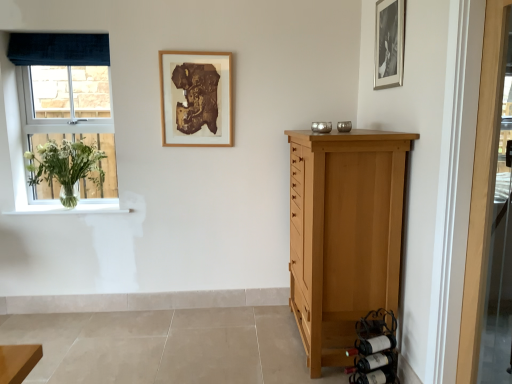
Question: Which direction should I rotate to face wooden picture frame at upper center, the 2th picture frame viewed from the front, — up or down?

Choices:
 (A) down
 (B) up

Answer: (B)

Question: From a real-world perspective, is light brown wood chest of drawers at right on dark brown glass wine bottle at lower right, which appears as the 3th wine bottle when viewed from the top?

Choices:
 (A) yes
 (B) no

Answer: (A)

Question: Considering the relative sizes of light brown wood chest of drawers at right and dark brown glass wine bottle at lower right, marked as the 1th wine bottle in a bottom-to-top arrangement, in the image provided, is light brown wood chest of drawers at right thinner than dark brown glass wine bottle at lower right, marked as the 1th wine bottle in a bottom-to-top arrangement,?

Choices:
 (A) yes
 (B) no

Answer: (B)

Question: Is light brown wood chest of drawers at right directly adjacent to dark brown glass wine bottle at lower right, marked as the 1th wine bottle in a bottom-to-top arrangement?

Choices:
 (A) yes
 (B) no

Answer: (B)

Question: Does light brown wood chest of drawers at right turn towards dark brown glass wine bottle at lower right, marked as the 1th wine bottle in a bottom-to-top arrangement?

Choices:
 (A) no
 (B) yes

Answer: (A)

Question: From the image's perspective, would you say light brown wood chest of drawers at right is positioned over dark brown glass wine bottle at lower right, which appears as the 3th wine bottle when viewed from the top?

Choices:
 (A) no
 (B) yes

Answer: (B)

Question: Is light brown wood chest of drawers at right not inside dark brown glass wine bottle at lower right, marked as the 1th wine bottle in a bottom-to-top arrangement?

Choices:
 (A) yes
 (B) no

Answer: (A)

Question: Is dark brown glass wine bottle at lower right, marked as the 1th wine bottle in a bottom-to-top arrangement, located within dark red glass wine bottle at lower right, which appears as the second wine bottle when ordered from the bottom?

Choices:
 (A) no
 (B) yes

Answer: (A)

Question: Considering the relative positions of dark red glass wine bottle at lower right, which is counted as the 2th wine bottle, starting from the top, and dark brown glass wine bottle at lower right, marked as the 1th wine bottle in a bottom-to-top arrangement, in the image provided, is dark red glass wine bottle at lower right, which is counted as the 2th wine bottle, starting from the top, behind dark brown glass wine bottle at lower right, marked as the 1th wine bottle in a bottom-to-top arrangement,?

Choices:
 (A) yes
 (B) no

Answer: (B)

Question: Does dark red glass wine bottle at lower right, which appears as the second wine bottle when ordered from the bottom, have a lesser width compared to dark brown glass wine bottle at lower right, which appears as the 3th wine bottle when viewed from the top?

Choices:
 (A) no
 (B) yes

Answer: (B)

Question: Is dark red glass wine bottle at lower right, which is counted as the 2th wine bottle, starting from the top, closer to the viewer compared to dark brown glass wine bottle at lower right, which appears as the 3th wine bottle when viewed from the top?

Choices:
 (A) no
 (B) yes

Answer: (B)

Question: Is dark red glass wine bottle at lower right, which appears as the second wine bottle when ordered from the bottom, wider than dark brown glass wine bottle at lower right, marked as the 1th wine bottle in a bottom-to-top arrangement?

Choices:
 (A) no
 (B) yes

Answer: (A)

Question: Is there a large distance between dark red glass wine bottle at lower right, which appears as the second wine bottle when ordered from the bottom, and dark brown glass wine bottle at lower right, which appears as the 3th wine bottle when viewed from the top?

Choices:
 (A) no
 (B) yes

Answer: (A)

Question: Does dark blue velvet curtain at upper left have a lesser width compared to black matte picture frame at upper right, acting as the 2th picture frame starting from the back?

Choices:
 (A) yes
 (B) no

Answer: (B)